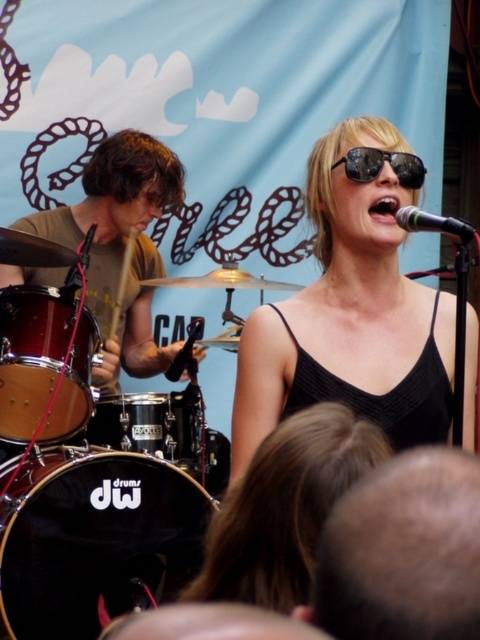
Question: Is the position of wooden drum at left more distant than that of black reflective sunglasses at center?

Choices:
 (A) yes
 (B) no

Answer: (A)

Question: Which point is farther to the camera?

Choices:
 (A) pos(408,180)
 (B) pos(147,186)

Answer: (B)

Question: Is black mesh tank top at upper center to the left of black metallic microphone at upper center from the viewer's perspective?

Choices:
 (A) yes
 (B) no

Answer: (A)

Question: Which of these objects is positioned farthest from the black drumhead at lower left?

Choices:
 (A) shiny silver drum at center
 (B) brown cotton shirt at left
 (C) black mesh tank top at upper center

Answer: (B)

Question: Where is wooden drum at left located in relation to shiny silver drum at center in the image?

Choices:
 (A) right
 (B) left

Answer: (B)

Question: Among these points, which one is nearest to the camera?

Choices:
 (A) (432, 221)
 (B) (93, 253)
 (C) (364, 147)
 (D) (72, 620)

Answer: (A)